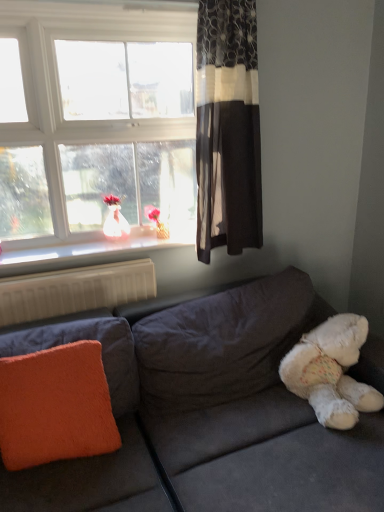
This screenshot has height=512, width=384. I want to click on free space above white plastic radiator at lower left (from a real-world perspective), so click(58, 269).